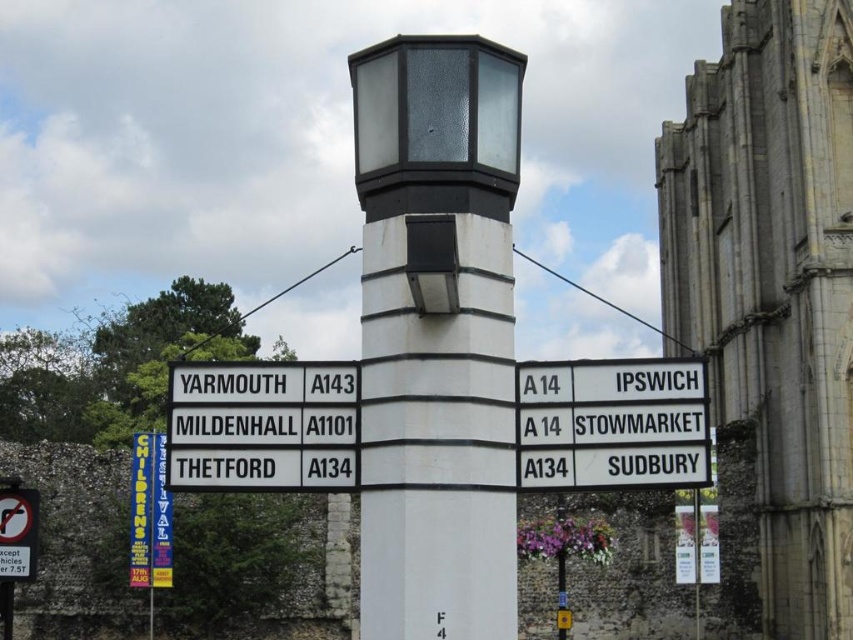
You are a pedestrian standing in front of the directional signpost. You see a white plastic sign at left and a black plastic sign at lower left. Which one is located higher up?

The white plastic sign at left is positioned over the black plastic sign at lower left, so it is higher up.

You are a traveler who just arrived at the crossroads and need to decide which direction to go. You see a white plastic sign at left and a blue fabric banner at lower left. Which object takes up more space in the scene?

The blue fabric banner at lower left occupies more space than the white plastic sign at left.